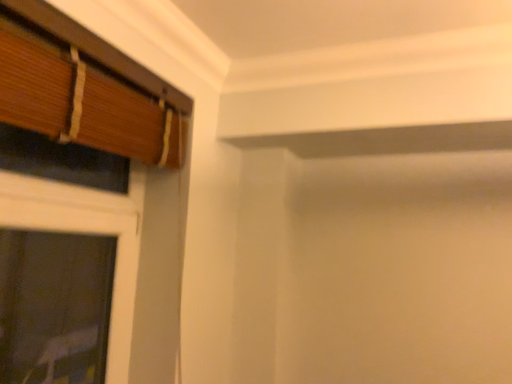
Locate an element on the screen. wooden blinds at left, which is the 2th window in left-to-right order is located at coordinates (88, 92).

In order to face wooden blinds at left, the first window in the right-to-left sequence, should I rotate leftwards or rightwards?

It's best to rotate left around 17.809 degrees.

This screenshot has width=512, height=384. What do you see at coordinates (88, 92) in the screenshot?
I see `wooden blinds at left, the first window in the right-to-left sequence` at bounding box center [88, 92].

Where is `wooden blinds at left, which is the 2th window from right to left`? The width and height of the screenshot is (512, 384). wooden blinds at left, which is the 2th window from right to left is located at coordinates (84, 212).

The height and width of the screenshot is (384, 512). What do you see at coordinates (84, 212) in the screenshot?
I see `wooden blinds at left, which is the 2th window from right to left` at bounding box center [84, 212].

Find the location of a particular element. This screenshot has width=512, height=384. wooden blinds at left, which is the 2th window in left-to-right order is located at coordinates [x=88, y=92].

Between wooden blinds at left, which is the 2th window from right to left, and wooden blinds at left, which is the 2th window in left-to-right order, which one appears on the left side from the viewer's perspective?

From the viewer's perspective, wooden blinds at left, which is the 2th window from right to left, appears more on the left side.

Is wooden blinds at left, which is the 2th window from right to left, positioned in front of wooden blinds at left, which is the 2th window in left-to-right order?

No, the depth of wooden blinds at left, which is the 2th window from right to left, is greater than that of wooden blinds at left, which is the 2th window in left-to-right order.

Does point (14, 256) lie behind point (42, 105)?

Yes.

From the image's perspective, is wooden blinds at left, which is the 2th window from right to left, beneath wooden blinds at left, which is the 2th window in left-to-right order?

Yes, from the image's perspective, wooden blinds at left, which is the 2th window from right to left, is beneath wooden blinds at left, which is the 2th window in left-to-right order.

From a real-world perspective, does wooden blinds at left, which is the 2th window from right to left, sit lower than wooden blinds at left, which is the 2th window in left-to-right order?

Yes.

Considering the relative sizes of wooden blinds at left, the 1th window positioned from the left, and wooden blinds at left, which is the 2th window in left-to-right order, in the image provided, is wooden blinds at left, the 1th window positioned from the left, thinner than wooden blinds at left, which is the 2th window in left-to-right order,?

In fact, wooden blinds at left, the 1th window positioned from the left, might be wider than wooden blinds at left, which is the 2th window in left-to-right order.

From their relative heights in the image, would you say wooden blinds at left, which is the 2th window from right to left, is taller or shorter than wooden blinds at left, which is the 2th window in left-to-right order?

Clearly, wooden blinds at left, which is the 2th window from right to left, is taller compared to wooden blinds at left, which is the 2th window in left-to-right order.

Considering the relative sizes of wooden blinds at left, which is the 2th window from right to left, and wooden blinds at left, the first window in the right-to-left sequence, in the image provided, is wooden blinds at left, which is the 2th window from right to left, bigger than wooden blinds at left, the first window in the right-to-left sequence,?

Yes, wooden blinds at left, which is the 2th window from right to left, is bigger than wooden blinds at left, the first window in the right-to-left sequence.

Could wooden blinds at left, the first window in the right-to-left sequence, be considered to be inside wooden blinds at left, which is the 2th window from right to left?

No, wooden blinds at left, the first window in the right-to-left sequence, is not inside wooden blinds at left, which is the 2th window from right to left.

Would you consider wooden blinds at left, which is the 2th window from right to left, to be distant from wooden blinds at left, which is the 2th window in left-to-right order?

No.

Is wooden blinds at left, the 1th window positioned from the left, facing away from wooden blinds at left, which is the 2th window in left-to-right order?

Yes, wooden blinds at left, the 1th window positioned from the left, is positioned with its back facing wooden blinds at left, which is the 2th window in left-to-right order.

Can you tell me how much wooden blinds at left, which is the 2th window from right to left, and wooden blinds at left, the first window in the right-to-left sequence, differ in facing direction?

0.233 degrees separate the facing orientations of wooden blinds at left, which is the 2th window from right to left, and wooden blinds at left, the first window in the right-to-left sequence.

In order to click on window that is below the wooden blinds at left, the first window in the right-to-left sequence (from the image's perspective) in this screenshot , I will do `click(84, 212)`.

Is wooden blinds at left, the first window in the right-to-left sequence, to the right of wooden blinds at left, the 1th window positioned from the left, from the viewer's perspective?

Indeed, wooden blinds at left, the first window in the right-to-left sequence, is positioned on the right side of wooden blinds at left, the 1th window positioned from the left.

Which is behind, wooden blinds at left, the first window in the right-to-left sequence, or wooden blinds at left, the 1th window positioned from the left?

wooden blinds at left, the 1th window positioned from the left, is further from the camera.

Does point (70, 57) come closer to viewer compared to point (126, 342)?

Yes, it is.

From the image's perspective, is wooden blinds at left, which is the 2th window in left-to-right order, over wooden blinds at left, which is the 2th window from right to left?

Yes, from the image's perspective, wooden blinds at left, which is the 2th window in left-to-right order, is on top of wooden blinds at left, which is the 2th window from right to left.

From a real-world perspective, is wooden blinds at left, which is the 2th window in left-to-right order, physically located above or below wooden blinds at left, the 1th window positioned from the left?

From a real-world perspective, wooden blinds at left, which is the 2th window in left-to-right order, is physically above wooden blinds at left, the 1th window positioned from the left.

Considering the relative sizes of wooden blinds at left, which is the 2th window in left-to-right order, and wooden blinds at left, which is the 2th window from right to left, in the image provided, is wooden blinds at left, which is the 2th window in left-to-right order, wider than wooden blinds at left, which is the 2th window from right to left,?

Incorrect, the width of wooden blinds at left, which is the 2th window in left-to-right order, does not surpass that of wooden blinds at left, which is the 2th window from right to left.

Based on the photo, considering the sizes of objects wooden blinds at left, the first window in the right-to-left sequence, and wooden blinds at left, which is the 2th window from right to left, in the image provided, who is shorter, wooden blinds at left, the first window in the right-to-left sequence, or wooden blinds at left, which is the 2th window from right to left,?

wooden blinds at left, the first window in the right-to-left sequence, is shorter.

Considering the relative sizes of wooden blinds at left, which is the 2th window in left-to-right order, and wooden blinds at left, which is the 2th window from right to left, in the image provided, is wooden blinds at left, which is the 2th window in left-to-right order, bigger than wooden blinds at left, which is the 2th window from right to left,?

Actually, wooden blinds at left, which is the 2th window in left-to-right order, might be smaller than wooden blinds at left, which is the 2th window from right to left.

Do you think wooden blinds at left, which is the 2th window in left-to-right order, is within wooden blinds at left, the 1th window positioned from the left, or outside of it?

wooden blinds at left, which is the 2th window in left-to-right order, cannot be found inside wooden blinds at left, the 1th window positioned from the left.

Would you consider wooden blinds at left, which is the 2th window in left-to-right order, to be distant from wooden blinds at left, which is the 2th window from right to left?

wooden blinds at left, which is the 2th window in left-to-right order, is near wooden blinds at left, which is the 2th window from right to left, not far away.

From the picture: Could you tell me if wooden blinds at left, the first window in the right-to-left sequence, is facing wooden blinds at left, which is the 2th window from right to left?

No, wooden blinds at left, the first window in the right-to-left sequence, does not turn towards wooden blinds at left, which is the 2th window from right to left.

You are a GUI agent. You are given a task and a screenshot of the screen. Output one action in this format:
    pyautogui.click(x=<x>, y=<y>)
    Task: Click on the window behind the wooden blinds at left, which is the 2th window in left-to-right order
    This screenshot has width=512, height=384.
    Given the screenshot: What is the action you would take?
    pyautogui.click(x=84, y=212)

Find the location of `window above the wooden blinds at left, the 1th window positioned from the left (from the image's perspective)`. window above the wooden blinds at left, the 1th window positioned from the left (from the image's perspective) is located at coordinates (88, 92).

Locate an element on the screen. Image resolution: width=512 pixels, height=384 pixels. window on the right of the wooden blinds at left, which is the 2th window from right to left is located at coordinates (88, 92).